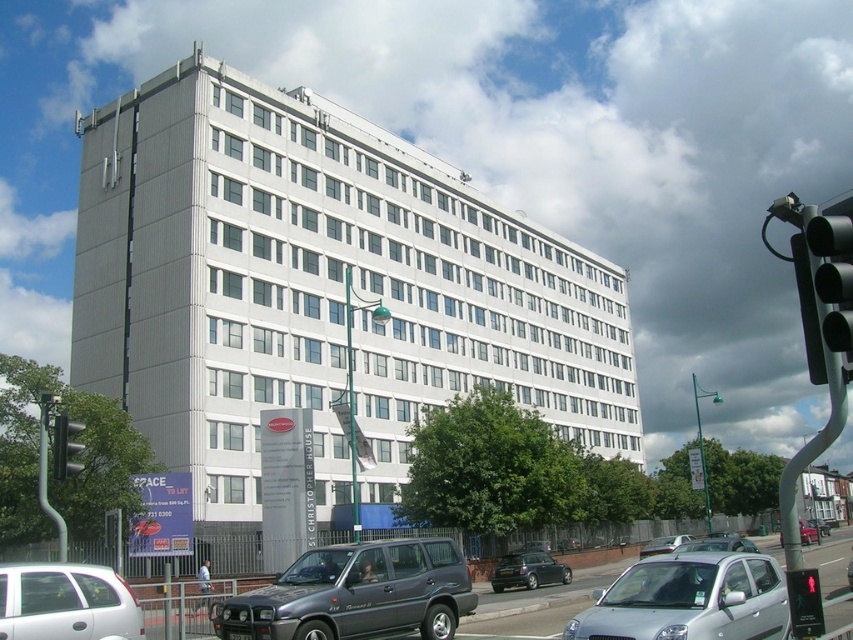
Question: Which object is the farthest from the metallic gray car at lower center?

Choices:
 (A) black plastic traffic light at right
 (B) green glass traffic light at left
 (C) white matte hatchback at lower left

Answer: (A)

Question: Which object is the farthest from the black plastic traffic light at right?

Choices:
 (A) metallic gray car at lower center
 (B) silver metallic hatchback at lower center

Answer: (A)

Question: Which object appears farthest from the camera in this image?

Choices:
 (A) green glass traffic light at left
 (B) metallic gray car at lower center
 (C) white matte hatchback at lower left
 (D) black plastic traffic light at right

Answer: (B)

Question: Is black plastic traffic light at right behind silver metallic sedan at center?

Choices:
 (A) yes
 (B) no

Answer: (B)

Question: Is black plastic traffic light at right to the left of green glass traffic light at left from the viewer's perspective?

Choices:
 (A) no
 (B) yes

Answer: (A)

Question: Is silver metallic hatchback at lower center closer to the viewer compared to silver metallic sedan at center?

Choices:
 (A) no
 (B) yes

Answer: (B)